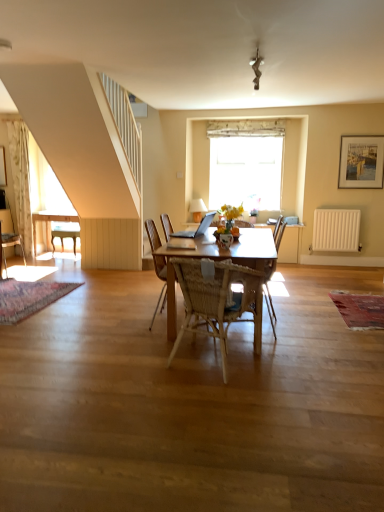
Locate an element on the screen. free location to the left of woven wood chair at center, which ranks as the first chair in front-to-back order is located at coordinates coord(132,360).